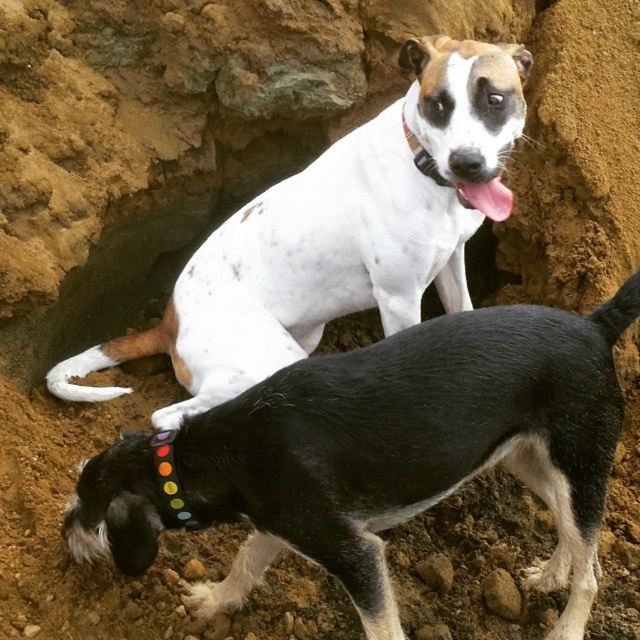
Consider the image. You are a photographer aiming to capture a clear photo of the black smooth dog at center and the black fabric neckband at upper center. Which object will appear larger in your photo?

The black smooth dog at center will appear larger in the photo because it is closer to the viewer than the black fabric neckband at upper center.

You are a photographer trying to capture both the black smooth dog at center and the white speckled fur at center in a single shot. Based on their positions, which dog is positioned lower in the frame?

The black smooth dog at center is located below the white speckled fur at center, so it is positioned lower in the frame.